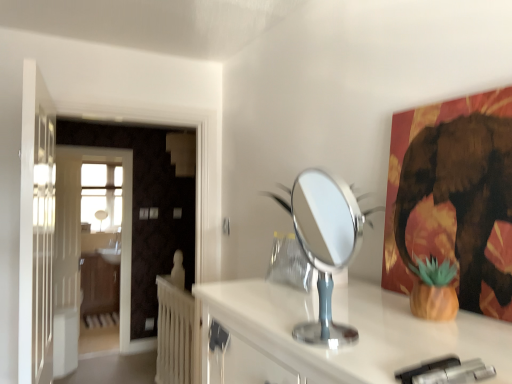
Question: Would you say silver metallic mirror at center is part of white glossy sink at center's contents?

Choices:
 (A) yes
 (B) no

Answer: (B)

Question: Does white glossy sink at center have a lesser height compared to silver metallic mirror at center?

Choices:
 (A) yes
 (B) no

Answer: (A)

Question: Is white glossy sink at center not inside silver metallic mirror at center?

Choices:
 (A) yes
 (B) no

Answer: (A)

Question: Can you confirm if white glossy sink at center is smaller than silver metallic mirror at center?

Choices:
 (A) no
 (B) yes

Answer: (A)

Question: Is white glossy sink at center taller than silver metallic mirror at center?

Choices:
 (A) yes
 (B) no

Answer: (B)

Question: In terms of width, does white wooden door at left, which is the 2th door in front-to-back order, look wider or thinner when compared to white glossy sink at center?

Choices:
 (A) wide
 (B) thin

Answer: (B)

Question: Relative to white glossy sink at center, is white wooden door at left, which ranks as the second door in right-to-left order, in front or behind?

Choices:
 (A) behind
 (B) front

Answer: (B)

Question: Does point (67, 160) appear closer or farther from the camera than point (112, 249)?

Choices:
 (A) closer
 (B) farther

Answer: (A)

Question: From the image's perspective, is white wooden door at left, which ranks as the second door in right-to-left order, above or below white glossy sink at center?

Choices:
 (A) below
 (B) above

Answer: (B)

Question: Is point (117, 256) positioned closer to the camera than point (303, 180)?

Choices:
 (A) closer
 (B) farther

Answer: (B)

Question: Considering the positions of white glossy sink at center and silver metallic mirror at center in the image, is white glossy sink at center wider or thinner than silver metallic mirror at center?

Choices:
 (A) thin
 (B) wide

Answer: (B)

Question: Considering their positions, is white glossy sink at center located in front of or behind silver metallic mirror at center?

Choices:
 (A) front
 (B) behind

Answer: (B)

Question: From a real-world perspective, is white glossy sink at center positioned above or below silver metallic mirror at center?

Choices:
 (A) below
 (B) above

Answer: (A)

Question: In terms of width, does white wooden door at left, the 1th door when ordered from back to front, look wider or thinner when compared to metallic gold elephant at upper right?

Choices:
 (A) wide
 (B) thin

Answer: (B)

Question: Is white wooden door at left, which is the 2th door in front-to-back order, in front of or behind metallic gold elephant at upper right in the image?

Choices:
 (A) behind
 (B) front

Answer: (A)